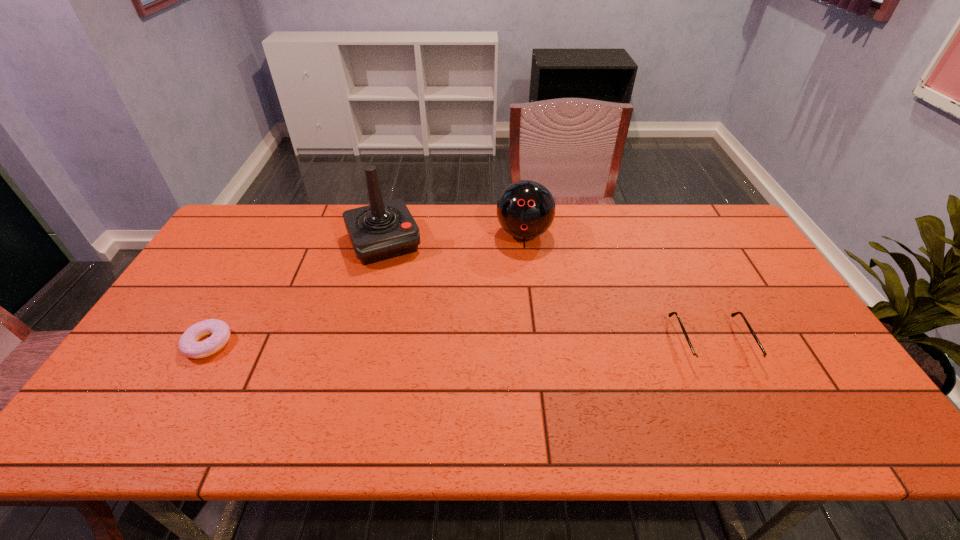
The image size is (960, 540). I want to click on vacant space located on the front-facing side of the third object from right to left, so click(407, 293).

Where is `vacant position located on the front-facing side of the third object from right to left`? vacant position located on the front-facing side of the third object from right to left is located at coordinates (430, 345).

You are a GUI agent. You are given a task and a screenshot of the screen. Output one action in this format:
    pyautogui.click(x=<x>, y=<y>)
    Task: Click on the vacant region located on the front-facing side of the third object from right to left
    Image resolution: width=960 pixels, height=540 pixels.
    Given the screenshot: What is the action you would take?
    pyautogui.click(x=419, y=318)

This screenshot has width=960, height=540. I want to click on vacant space situated on the surface of the bowling ball near the finger holes, so click(x=516, y=309).

Find the location of a particular element. This screenshot has height=540, width=960. free location located 0.140m on the surface of the bowling ball near the finger holes is located at coordinates (519, 280).

You are a GUI agent. You are given a task and a screenshot of the screen. Output one action in this format:
    pyautogui.click(x=<x>, y=<y>)
    Task: Click on the free space located on the surface of the bowling ball near the finger holes
    Image resolution: width=960 pixels, height=540 pixels.
    Given the screenshot: What is the action you would take?
    pyautogui.click(x=520, y=269)

The image size is (960, 540). In order to click on joystick at the far edge in this screenshot , I will do `click(382, 230)`.

At what (x,y) coordinates should I click in order to perform the action: click on bowling ball that is at the far edge. Please return your answer as a coordinate pair (x, y). This screenshot has height=540, width=960. Looking at the image, I should click on (526, 209).

This screenshot has height=540, width=960. Identify the location of object at the near edge. (704, 361).

Identify the location of object located in the left edge section of the desktop. (219, 330).